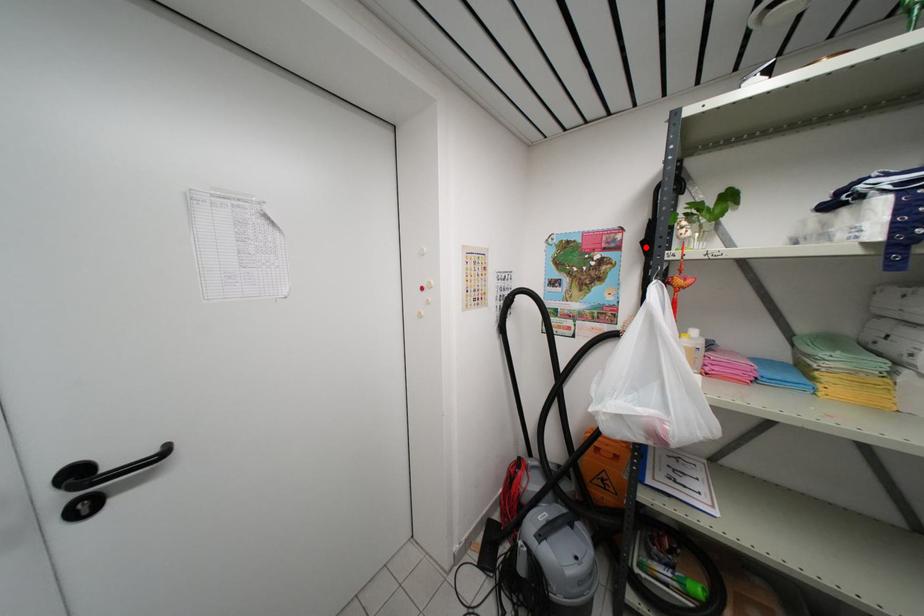
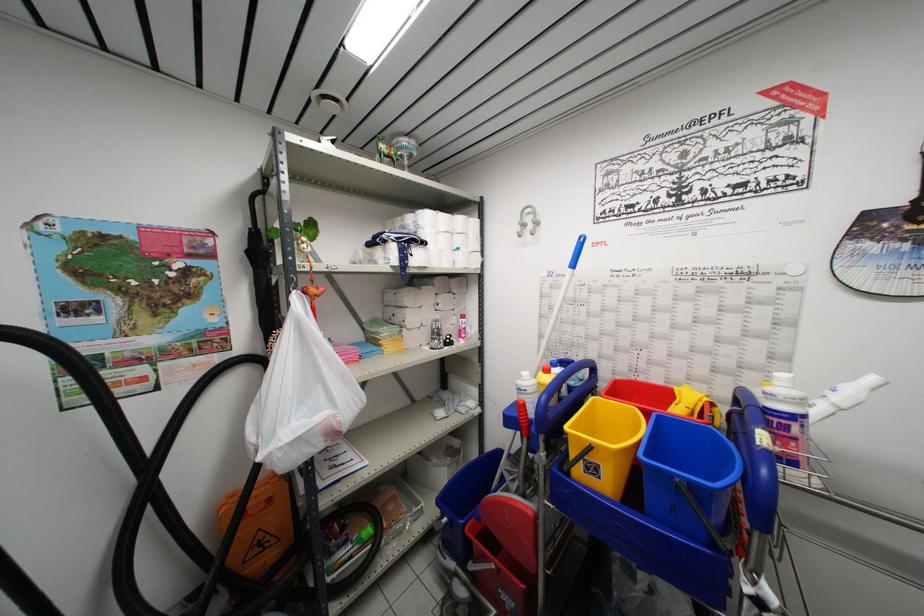
Locate, in the second image, the point that corresponds to the highlighted location in the first image.

(250, 257)